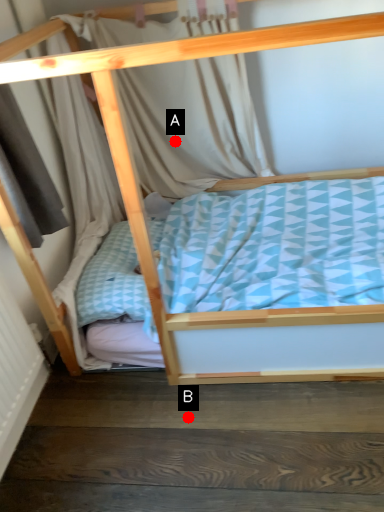
Question: Two points are circled on the image, labeled by A and B beside each circle. Which point is further to the camera?

Choices:
 (A) A is further
 (B) B is further

Answer: (A)